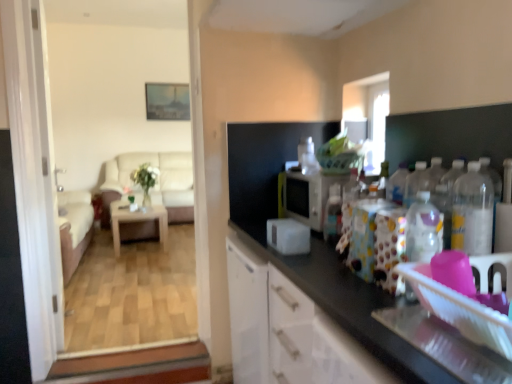
Where is `clear plastic bottles at right, arranged as the first bottle when viewed from the front`? The width and height of the screenshot is (512, 384). clear plastic bottles at right, arranged as the first bottle when viewed from the front is located at coordinates (472, 212).

Find the location of `white plastic toaster at center, which is the first appliance in front-to-back order`. white plastic toaster at center, which is the first appliance in front-to-back order is located at coordinates (288, 236).

I want to click on beige fabric couch at left, so click(156, 181).

What do you see at coordinates (156, 181) in the screenshot?
I see `beige fabric couch at left` at bounding box center [156, 181].

This screenshot has height=384, width=512. Identify the location of clear plastic bottles at right, arranged as the first bottle when viewed from the front. (472, 212).

Does clear plastic bottle at right, the 2th bottle from the front, have a greater width compared to beige fabric couch at left?

Incorrect, the width of clear plastic bottle at right, the 2th bottle from the front, does not surpass that of beige fabric couch at left.

Considering the positions of objects clear plastic bottle at right, positioned as the 2th bottle in back-to-front order, and beige fabric couch at left in the image provided, who is more to the right, clear plastic bottle at right, positioned as the 2th bottle in back-to-front order, or beige fabric couch at left?

clear plastic bottle at right, positioned as the 2th bottle in back-to-front order, is more to the right.

Which is correct: clear plastic bottle at right, the 2th bottle from the front, is inside beige fabric couch at left, or outside of it?

clear plastic bottle at right, the 2th bottle from the front, lies outside beige fabric couch at left.

Is wooden table at center far away from white plastic toaster at center, the second appliance viewed from the back?

Yes, wooden table at center and white plastic toaster at center, the second appliance viewed from the back, are located far from each other.

From the image's perspective, is wooden table at center beneath white plastic toaster at center, the second appliance viewed from the back?

Yes.

Which object is positioned more to the left, wooden table at center or white plastic toaster at center, the second appliance viewed from the back?

wooden table at center.

Considering the positions of point (136, 221) and point (303, 236), is point (136, 221) closer or farther from the camera than point (303, 236)?

Point (136, 221) is positioned farther from the camera compared to point (303, 236).

Is clear plastic bottles at right, which is the 2th bottle from left to right, oriented away from clear plastic bottle at right, positioned as the 2th bottle in back-to-front order?

Yes, clear plastic bottles at right, which is the 2th bottle from left to right, is positioned with its back facing clear plastic bottle at right, positioned as the 2th bottle in back-to-front order.

Which is more distant, (484, 250) or (500, 186)?

The point (500, 186) is more distant.

Is clear plastic bottles at right, which ranks as the 2th bottle in right-to-left order, positioned in front of clear plastic bottle at right, positioned as the first bottle in right-to-left order?

Yes, clear plastic bottles at right, which ranks as the 2th bottle in right-to-left order, is in front of clear plastic bottle at right, positioned as the first bottle in right-to-left order.

Considering the sizes of objects clear plastic bottle at right, positioned as the 2th bottle in back-to-front order, and green glass vase at center in the image provided, who is thinner, clear plastic bottle at right, positioned as the 2th bottle in back-to-front order, or green glass vase at center?

With smaller width is clear plastic bottle at right, positioned as the 2th bottle in back-to-front order.

Based on their sizes in the image, would you say clear plastic bottle at right, the 2th bottle from the front, is bigger or smaller than green glass vase at center?

Result: Considering their sizes, clear plastic bottle at right, the 2th bottle from the front, takes up less space than green glass vase at center.

From a real-world perspective, who is located lower, clear plastic bottle at right, positioned as the first bottle in right-to-left order, or green glass vase at center?

green glass vase at center, from a real-world perspective.

Between point (498, 188) and point (132, 179), which one is positioned in front?

The point (498, 188) is closer to the camera.

Looking at this image, from a real-world perspective, which object stands above the other?

green glass vase at center.

Is green glass vase at center not inside white matte cabinet at center?

That's correct, green glass vase at center is outside of white matte cabinet at center.

Locate an element on the screen. This screenshot has height=384, width=512. couch behind the transparent glass window at upper center is located at coordinates (156, 181).

Which of these two, transparent glass window at upper center or beige fabric couch at left, stands shorter?

Standing shorter between the two is transparent glass window at upper center.

From the image's perspective, is transparent glass window at upper center located beneath beige fabric couch at left?

No.

Considering the relative positions of transparent glass window at upper center and beige fabric couch at left in the image provided, is transparent glass window at upper center to the right of beige fabric couch at left from the viewer's perspective?

Indeed, transparent glass window at upper center is positioned on the right side of beige fabric couch at left.

Does point (319, 309) come farther from viewer compared to point (336, 215)?

No.

Looking at this image, which object is positioned more to the right, white matte cabinet at center or translucent plastic bottle at center, the 1th bottle positioned from the back?

Positioned to the right is translucent plastic bottle at center, the 1th bottle positioned from the back.

From the image's perspective, which one is positioned higher, white matte cabinet at center or translucent plastic bottle at center, the 3th bottle when ordered from front to back?

translucent plastic bottle at center, the 3th bottle when ordered from front to back, is shown above in the image.

The image size is (512, 384). In order to click on bottle that is the 1st object above the white matte cabinet at center (from a real-world perspective) in this screenshot , I will do `click(333, 214)`.

Find the location of a particular element. the 3rd bottle counting from the right of the beige fabric couch at left is located at coordinates (493, 188).

Which appliance is the 2nd one when counting from the front of the wooden table at center? Please provide its 2D coordinates.

[(288, 236)]

From the image, which object appears to be farther from beige fabric couch at left, white matte cabinet at center or transparent glass window at upper center?

Based on the image, white matte cabinet at center appears to be further to beige fabric couch at left.

When comparing their distances from clear plastic bottle at right, positioned as the first bottle in right-to-left order, does white glossy door at left, positioned as the second screen door in right-to-left order, or transparent glass window at upper center seem further?

white glossy door at left, positioned as the second screen door in right-to-left order, is positioned further to the anchor clear plastic bottle at right, positioned as the first bottle in right-to-left order.

Based on their spatial positions, is white matte microwave at center, placed as the 1th appliance when sorted from back to front, or green glass vase at center further from clear plastic bottle at right, positioned as the 2th bottle in back-to-front order?

green glass vase at center.

Based on their spatial positions, is transparent glass window at upper center or white glossy screen door at left, the 1th screen door when ordered from right to left, further from white matte cabinet at center?

white glossy screen door at left, the 1th screen door when ordered from right to left, is further to white matte cabinet at center.

Considering their positions, is transparent glass window at upper center positioned further to white glossy door at left, positioned as the 1th screen door in left-to-right order, than translucent plastic bottle at center, which is counted as the 3th bottle, starting from the right?

transparent glass window at upper center is further to white glossy door at left, positioned as the 1th screen door in left-to-right order.

When comparing their distances from white matte cabinet at center, does clear plastic bottles at right, which ranks as the 2th bottle in right-to-left order, or clear plastic bottle at right, positioned as the 2th bottle in back-to-front order, seem further?

clear plastic bottle at right, positioned as the 2th bottle in back-to-front order, lies further to white matte cabinet at center than the other object.

Based on their spatial positions, is white glossy door at left, positioned as the 1th screen door in left-to-right order, or transparent glass window at upper center further from beige fabric couch at left?

transparent glass window at upper center.

From the image, which object appears to be farther from beige fabric couch at left, wooden table at center or clear plastic bottle at right, positioned as the first bottle in right-to-left order?

clear plastic bottle at right, positioned as the first bottle in right-to-left order.

Locate an element on the screen. The width and height of the screenshot is (512, 384). window between white matte microwave at center, placed as the 2th appliance when sorted from front to back, and beige fabric couch at left in the front-back direction is located at coordinates coord(367,114).

The height and width of the screenshot is (384, 512). Identify the location of window between clear plastic bottles at right, which ranks as the 2th bottle in right-to-left order, and wooden table at center from front to back. 367,114.

Identify the location of cabinetry between clear plastic bottle at right, placed as the third bottle when sorted from left to right, and translucent plastic bottle at center, the 1th bottle from the left, from front to back. (287, 330).

The image size is (512, 384). I want to click on table positioned between clear plastic bottles at right, which is the 2th bottle from left to right, and green glass vase at center from near to far, so click(x=138, y=219).